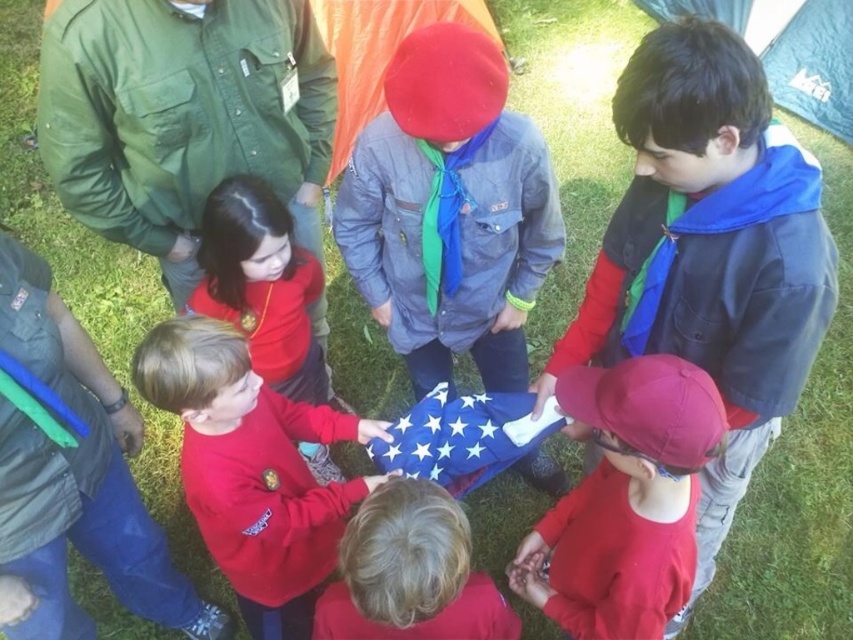
Question: Does red matte shirt at lower left appear under matte blue fabric at lower center?

Choices:
 (A) yes
 (B) no

Answer: (B)

Question: Considering the real-world distances, which object is closest to the orange fabric tent at center?

Choices:
 (A) red matte shirt at lower left
 (B) matte red sweatshirt at center
 (C) green fabric tent at upper right

Answer: (A)

Question: Can you confirm if matte red sweatshirt at center is positioned below green fabric tent at upper right?

Choices:
 (A) no
 (B) yes

Answer: (B)

Question: Which point is farther from the camera taking this photo?

Choices:
 (A) (253, 310)
 (B) (374, 484)

Answer: (A)

Question: Which of the following is the farthest from the observer?

Choices:
 (A) orange fabric tent at center
 (B) red matte cap at center

Answer: (A)

Question: Can you confirm if red matte cap at center is positioned above orange fabric tent at center?

Choices:
 (A) yes
 (B) no

Answer: (B)